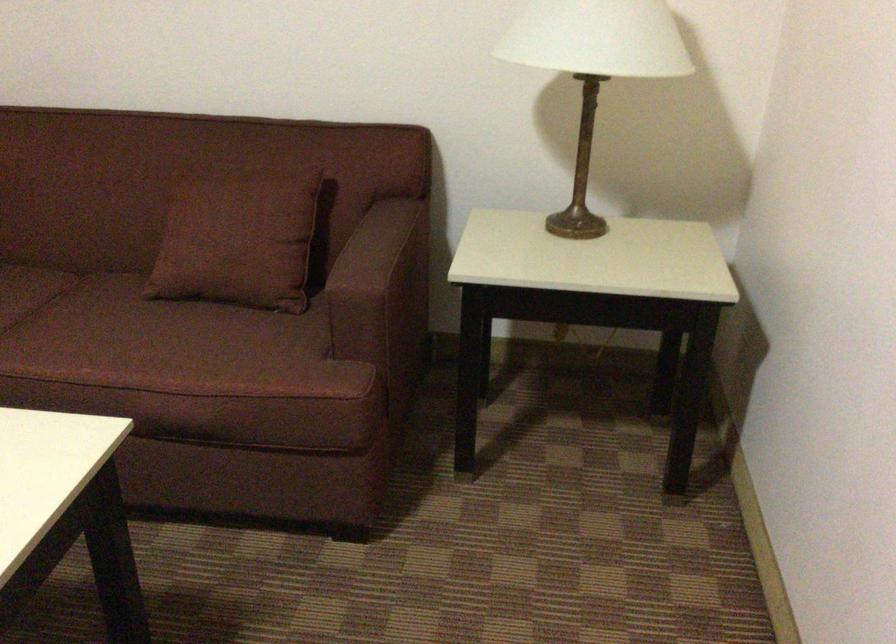
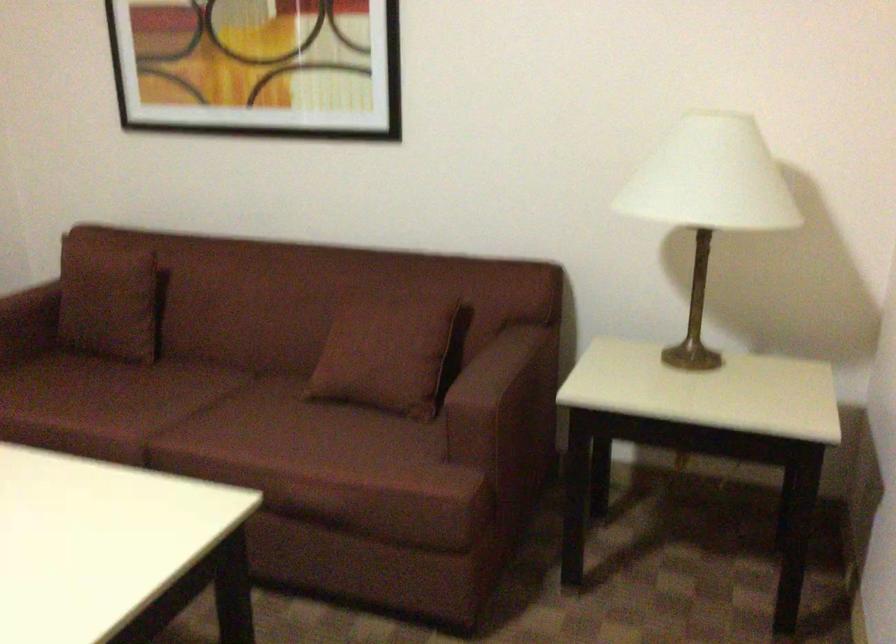
The images are taken continuously from a first-person perspective. In which direction are you moving?

The cameraman walked toward right, backward.